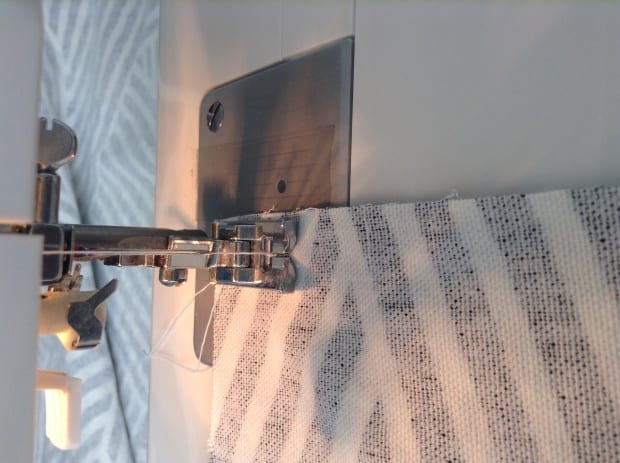
At what (x,y) coordinates should I click in order to perform the action: click on metal knob. Please return your answer as a coordinate pair (x, y). This screenshot has width=620, height=463. Looking at the image, I should click on (61, 145).